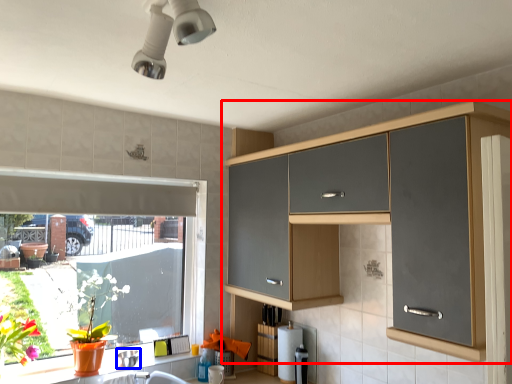
Question: Which object appears farthest to the camera in this image, cabinetry (highlighted by a red box) or appliance (highlighted by a blue box)?

Choices:
 (A) cabinetry
 (B) appliance

Answer: (B)